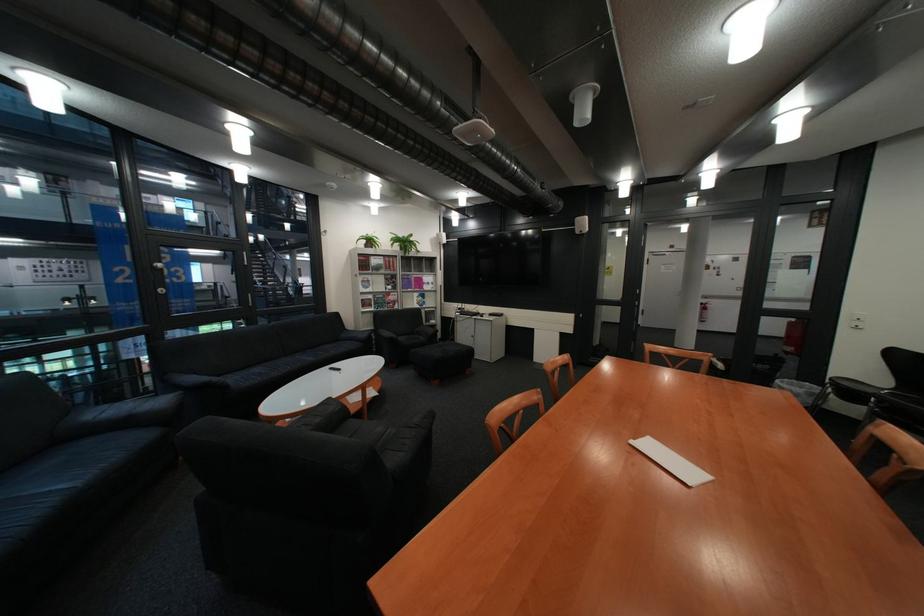
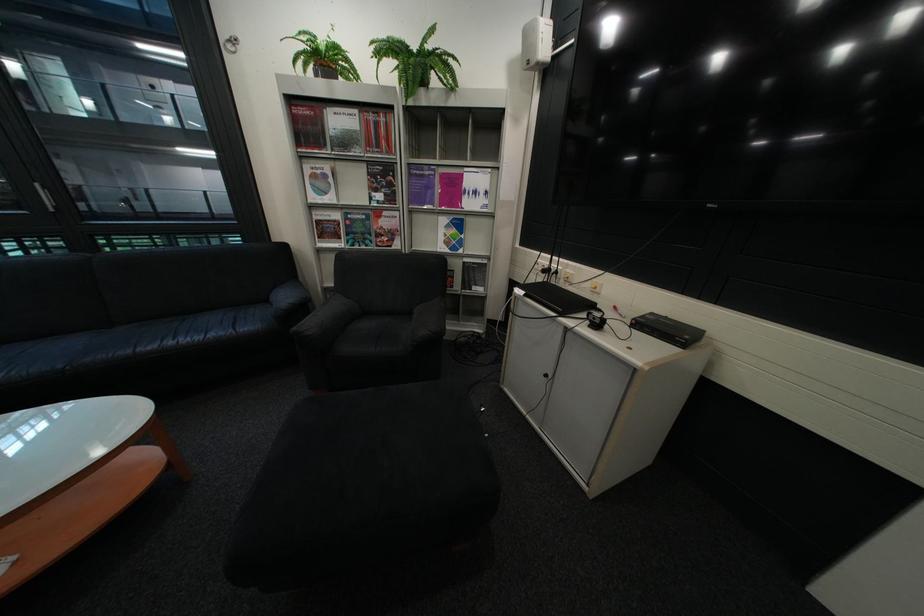
In the second image, find the point that corresponds to point (378, 270) in the first image.

(322, 147)